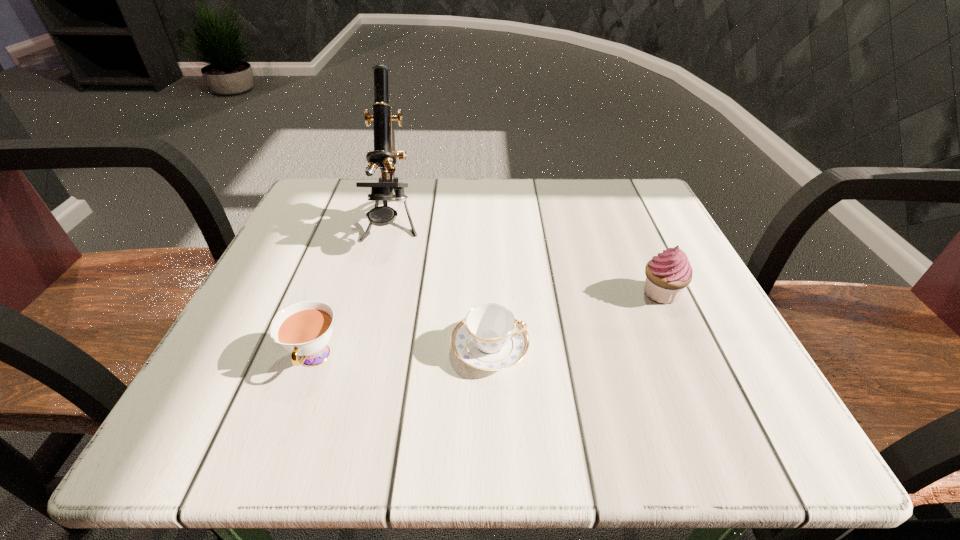
Locate an element on the screen. The height and width of the screenshot is (540, 960). microscope is located at coordinates (384, 155).

This screenshot has height=540, width=960. Find the location of `the farthest object`. the farthest object is located at coordinates (384, 155).

This screenshot has width=960, height=540. I want to click on the rightmost object, so click(667, 274).

At what (x,y) coordinates should I click in order to perform the action: click on cupcake. Please return your answer as a coordinate pair (x, y). The height and width of the screenshot is (540, 960). Looking at the image, I should click on (667, 274).

Where is `the second shortest object`? The height and width of the screenshot is (540, 960). the second shortest object is located at coordinates (304, 328).

In order to click on the left teacup in this screenshot , I will do [304, 328].

You are a GUI agent. You are given a task and a screenshot of the screen. Output one action in this format:
    pyautogui.click(x=<x>, y=<y>)
    Task: Click on the shortest object
    This screenshot has height=540, width=960.
    Given the screenshot: What is the action you would take?
    pyautogui.click(x=490, y=338)

At what (x,y) coordinates should I click in order to perform the action: click on the shorter teacup. Please return your answer as a coordinate pair (x, y). Looking at the image, I should click on (490, 338).

This screenshot has height=540, width=960. Identify the location of free space located through the eyepiece of the farthest object. (364, 334).

I want to click on free spot located 0.340m on the back of the cupcake, so click(612, 185).